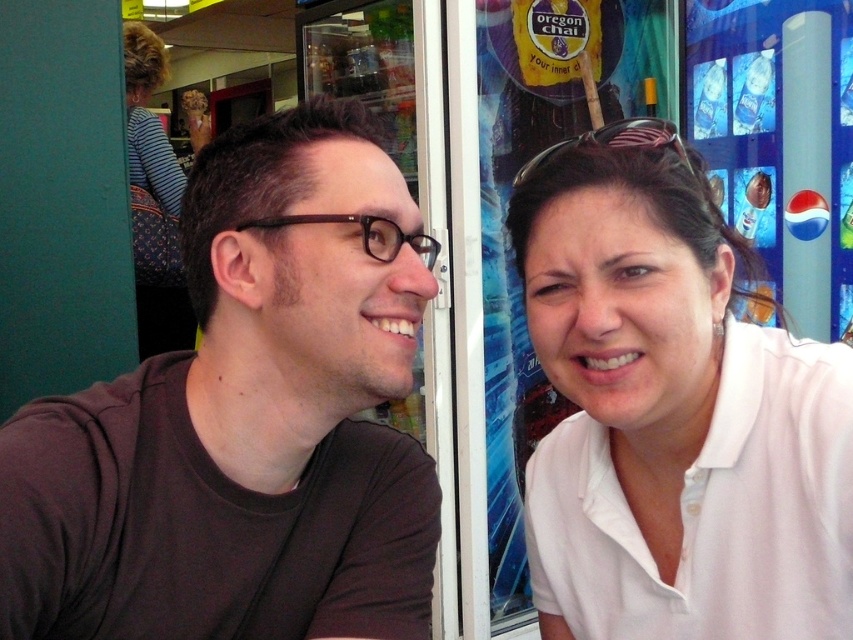
Is brown matte shirt at left smaller than white smooth shirt at right?

Incorrect, brown matte shirt at left is not smaller in size than white smooth shirt at right.

Which is below, brown matte shirt at left or white smooth shirt at right?

white smooth shirt at right

Between point (238, 634) and point (784, 484), which one is positioned behind?

The point (238, 634) is more distant.

At what (x,y) coordinates should I click in order to perform the action: click on brown matte shirt at left. Please return your answer as a coordinate pair (x, y). This screenshot has height=640, width=853. Looking at the image, I should click on (245, 420).